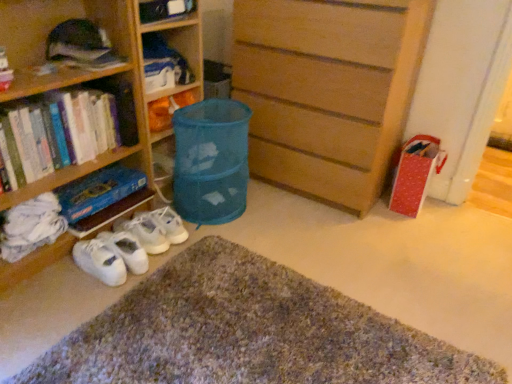
Where is `vacant space behind textured woolen doormat at lower center`? This screenshot has height=384, width=512. vacant space behind textured woolen doormat at lower center is located at coordinates (331, 238).